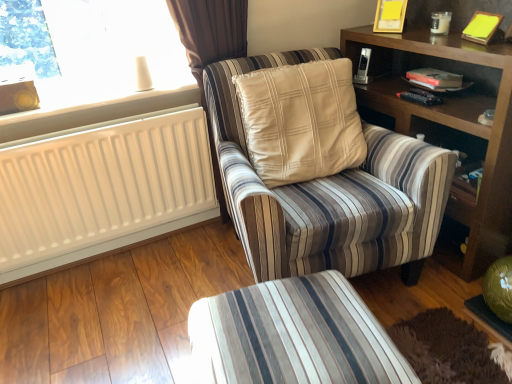
Question: Is white plastic radiator at upper left wider or thinner than wooden bookshelf at right?

Choices:
 (A) thin
 (B) wide

Answer: (A)

Question: From their relative heights in the image, would you say white plastic radiator at upper left is taller or shorter than wooden bookshelf at right?

Choices:
 (A) tall
 (B) short

Answer: (B)

Question: Which object is positioned farthest from the white plastic radiator at upper left?

Choices:
 (A) white matte radiator at left
 (B) striped fabric chair at center
 (C) striped fabric ottoman at lower center
 (D) wooden bookshelf at right
 (E) yellow paper at upper right

Answer: (E)

Question: Based on their relative distances, which object is nearer to the striped fabric ottoman at lower center?

Choices:
 (A) wooden bookshelf at right
 (B) white plastic radiator at upper left
 (C) yellow paper at upper right
 (D) white matte radiator at left
 (E) striped fabric chair at center

Answer: (E)